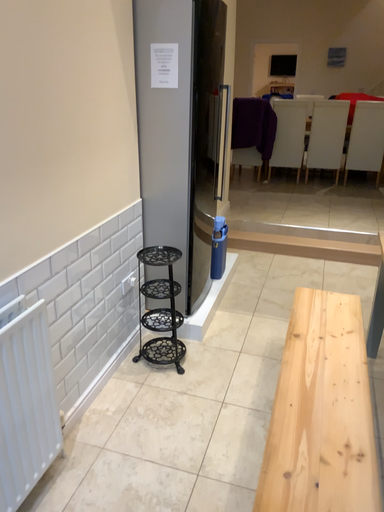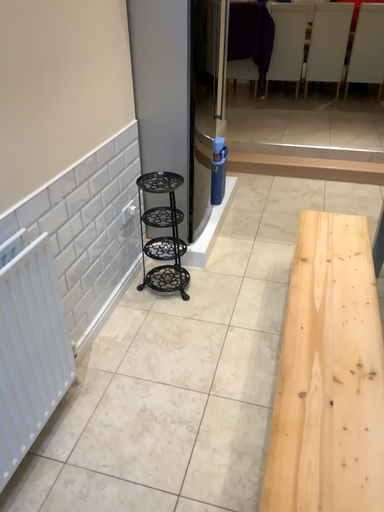
Question: Which way did the camera rotate in the video?

Choices:
 (A) rotated upward
 (B) rotated downward

Answer: (B)